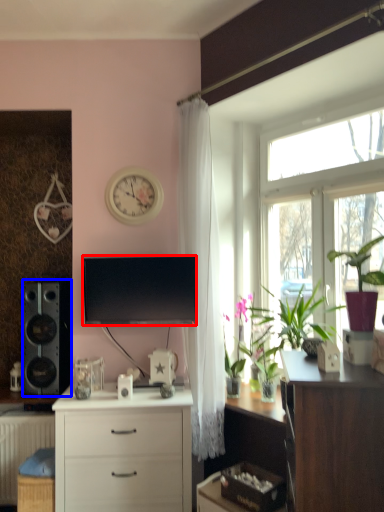
Question: Which point is closer to the camera, television (highlighted by a red box) or loudspeaker (highlighted by a blue box)?

Choices:
 (A) television
 (B) loudspeaker

Answer: (A)